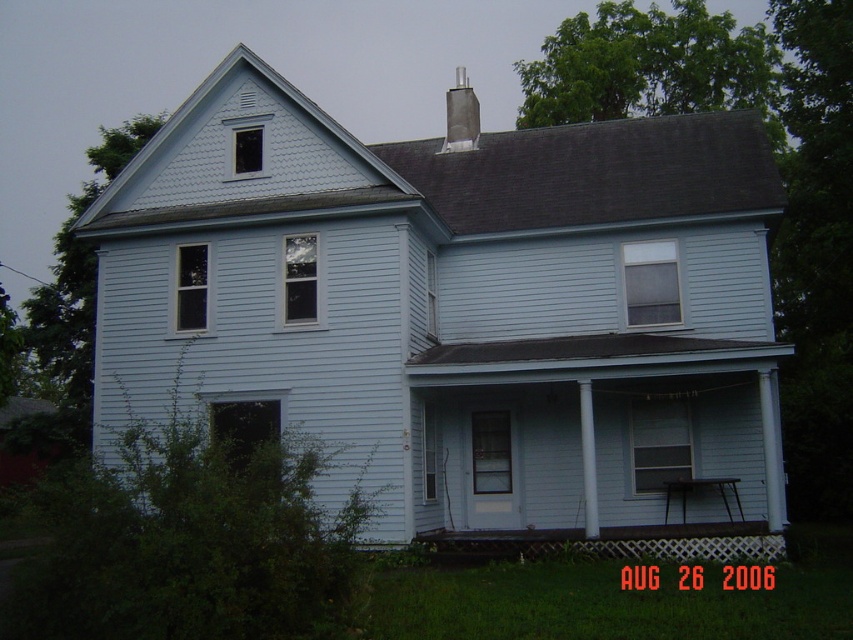
You are a painter standing at the front of the house. You need to paint both the white wood siding at center and the white lattice porch at lower center. Which area will require you to use a ladder because it is higher?

The white wood siding at center is much taller than the white lattice porch at lower center, so you will need a ladder to reach the white wood siding at center.

You are standing in front of the house and want to place a new flower pot on the closest object to you between the white lattice porch at lower center and the dark gray concrete chimney at upper center. Which object should you choose?

The white lattice porch at lower center is closer to the viewer than the dark gray concrete chimney at upper center, so you should place the flower pot on the white lattice porch at lower center.